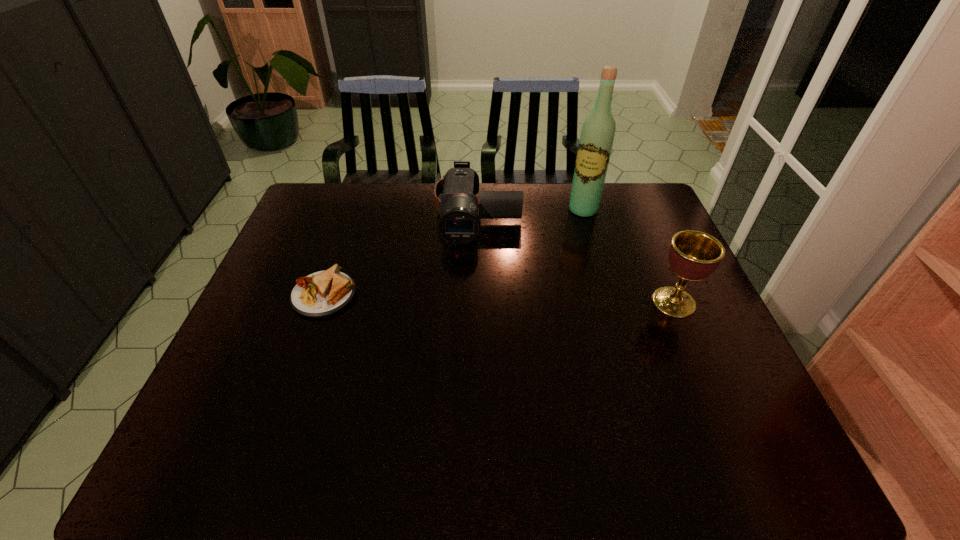
You are a GUI agent. You are given a task and a screenshot of the screen. Output one action in this format:
    pyautogui.click(x=<x>, y=<y>)
    Task: Click on the free space on the desktop that is between the sandwich and the rightmost object and is positioned on the lens of the second object from left to right
    The width and height of the screenshot is (960, 540).
    Given the screenshot: What is the action you would take?
    [x=474, y=298]

This screenshot has width=960, height=540. Find the location of `vacant space on the desktop that is between the shortest object and the chalice and is positioned on the front-facing side of the tallest object`. vacant space on the desktop that is between the shortest object and the chalice and is positioned on the front-facing side of the tallest object is located at coordinates (529, 299).